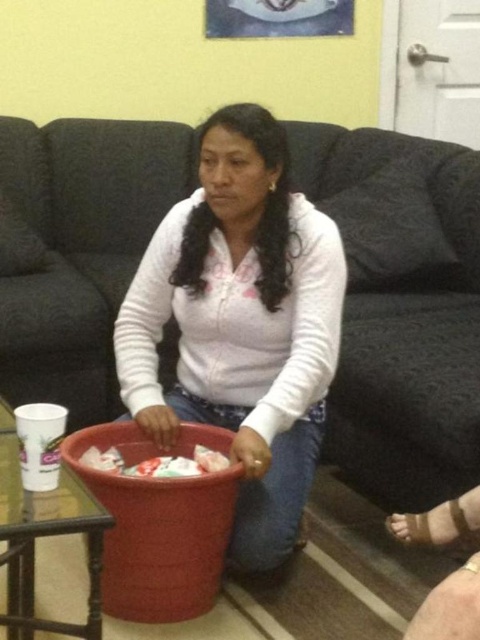
Question: Is the position of dark fabric couch at center less distant than that of white fleece at center?

Choices:
 (A) no
 (B) yes

Answer: (A)

Question: Which point is closer to the camera?

Choices:
 (A) dark fabric couch at center
 (B) white fleece at center

Answer: (B)

Question: Which object is closer to the camera taking this photo?

Choices:
 (A) dark fabric couch at center
 (B) white fleece at center

Answer: (B)

Question: Is dark fabric couch at center closer to camera compared to white fleece at center?

Choices:
 (A) no
 (B) yes

Answer: (A)

Question: Can you confirm if dark fabric couch at center is thinner than white fleece at center?

Choices:
 (A) no
 (B) yes

Answer: (A)